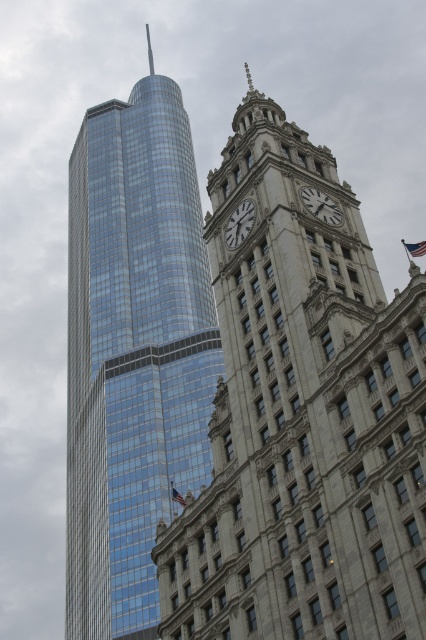
How distant is glassy steel skyscraper at center from white marble clock at upper center?

glassy steel skyscraper at center and white marble clock at upper center are 11.74 meters apart.

Who is shorter, glassy steel skyscraper at center or white marble clock at upper center?

Standing shorter between the two is white marble clock at upper center.

What do you see at coordinates (302, 417) in the screenshot? I see `glassy steel skyscraper at center` at bounding box center [302, 417].

Where is `glassy steel skyscraper at center`? The width and height of the screenshot is (426, 640). glassy steel skyscraper at center is located at coordinates (302, 417).

Is glassy steel skyscraper at center thinner than shiny glass skyscraper at left?

Yes, glassy steel skyscraper at center is thinner than shiny glass skyscraper at left.

Who is more forward, (285, 134) or (138, 529)?

Point (285, 134) is more forward.

Is point (238, 442) farther from viewer compared to point (69, 173)?

No, it is not.

At what (x,y) coordinates should I click in order to perform the action: click on glassy steel skyscraper at center. Please return your answer as a coordinate pair (x, y). Looking at the image, I should click on (302, 417).

What do you see at coordinates (302, 417) in the screenshot?
I see `glassy steel skyscraper at center` at bounding box center [302, 417].

Is point (385, 525) farther from camera compared to point (333, 205)?

No, (385, 525) is in front of (333, 205).

In order to click on glassy steel skyscraper at center in this screenshot , I will do `click(302, 417)`.